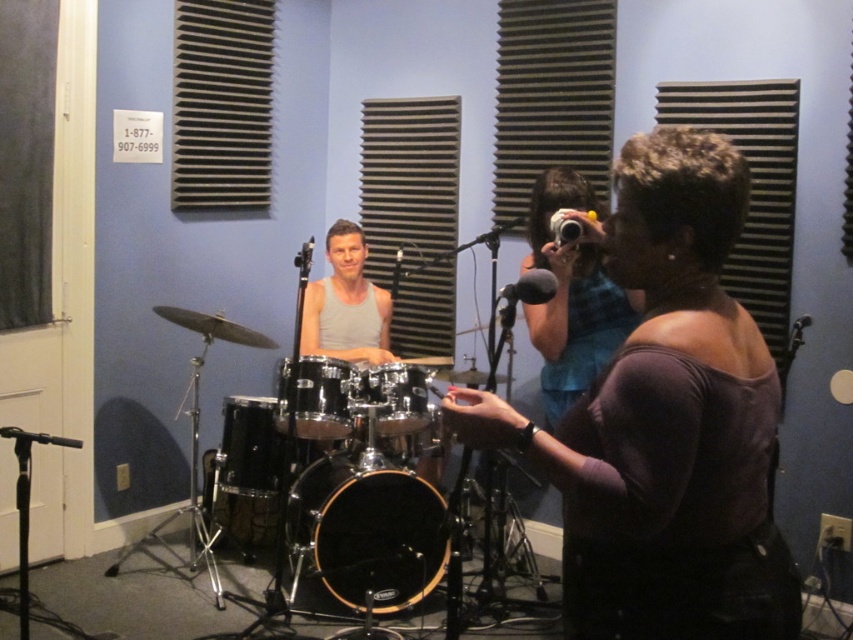
You are a sound engineer setting up a microphone stand between the black drum at lower center and the shiny chrome drum at center. Since the black drum is wider, will the stand fit snugly between them?

The black drum at lower center is wider than the shiny chrome drum at center, so placing the microphone stand between them would require adjusting for the width difference to ensure a snug fit.

You are a sound engineer setting up a microphone stand between the black drum at lower center and the shiny chrome drum at center. The stand requires 60 cm of space. Is there enough space between them to place the stand?

The distance between the black drum at lower center and the shiny chrome drum at center is 59.72 centimeters, which is slightly less than the required 60 cm. Therefore, there is not enough space to place the microphone stand between them.